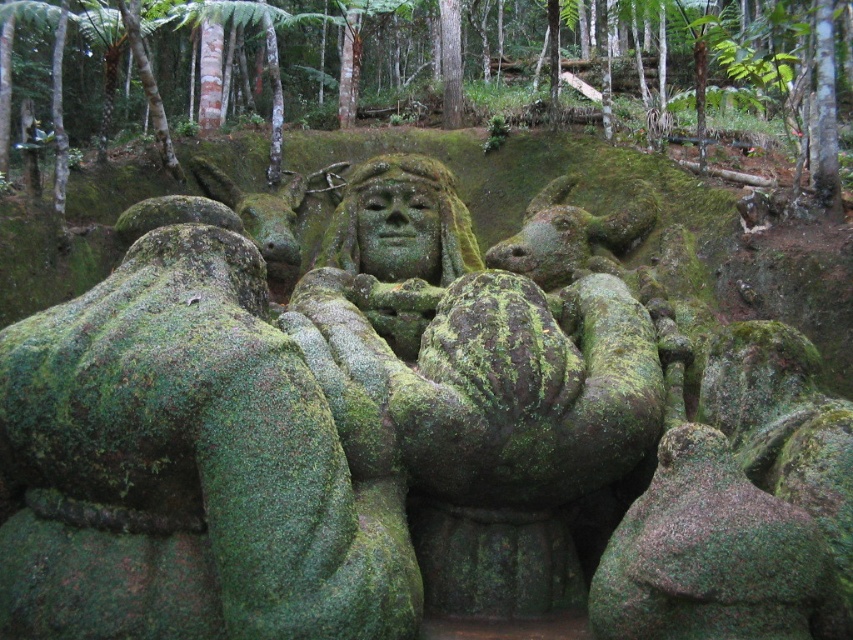
Question: Among these objects, which one is farthest from the camera?

Choices:
 (A) green mossy face at center
 (B) green mossy statue at center

Answer: (B)

Question: Is green mossy statue at center above green mossy face at center?

Choices:
 (A) no
 (B) yes

Answer: (B)

Question: Is green mossy statue at center to the left of green mossy face at center from the viewer's perspective?

Choices:
 (A) no
 (B) yes

Answer: (A)

Question: Can you confirm if green mossy statue at center is bigger than green mossy face at center?

Choices:
 (A) no
 (B) yes

Answer: (B)